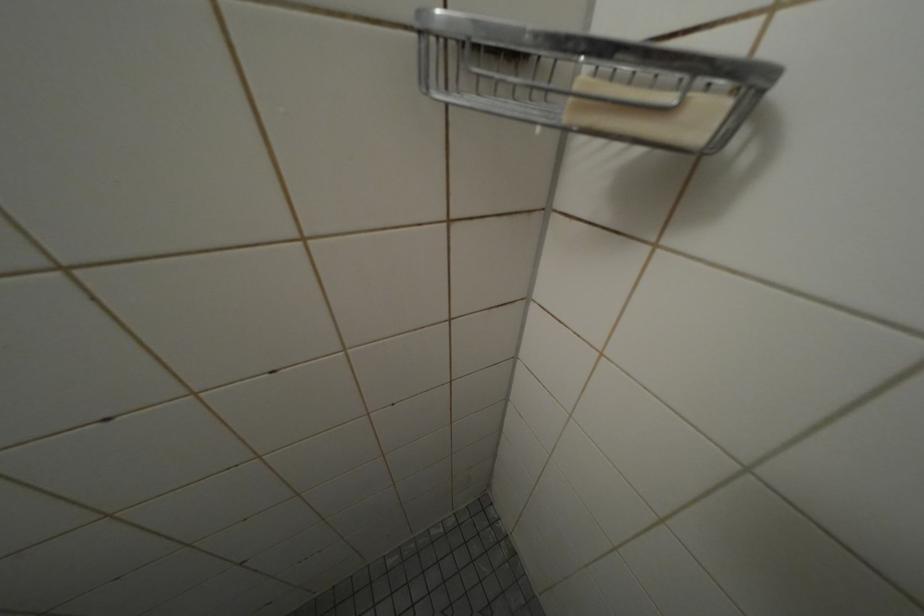
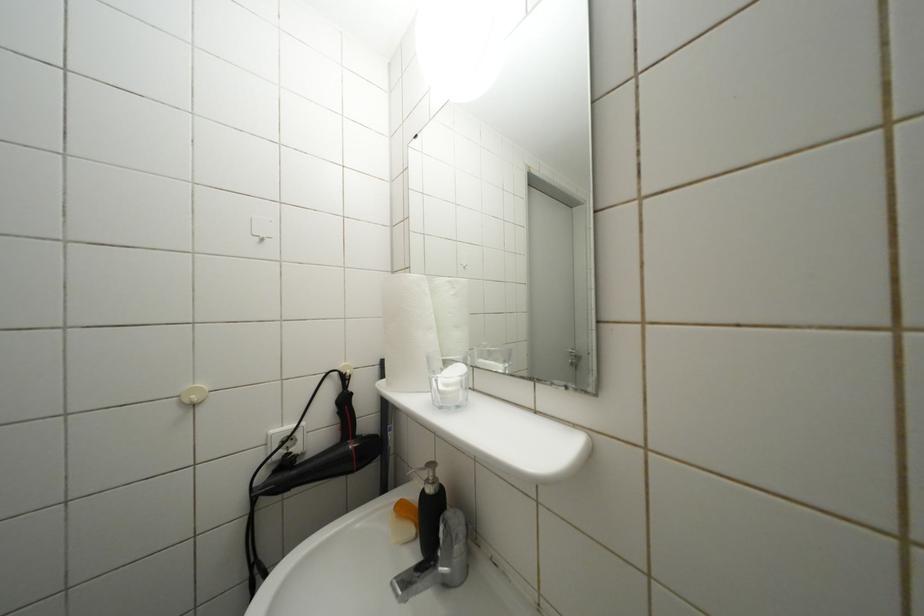
Question: The first image is from the beginning of the video and the second image is from the end. How did the camera likely rotate when shooting the video?

Choices:
 (A) Left
 (B) Right
 (C) Up
 (D) Down

Answer: (A)